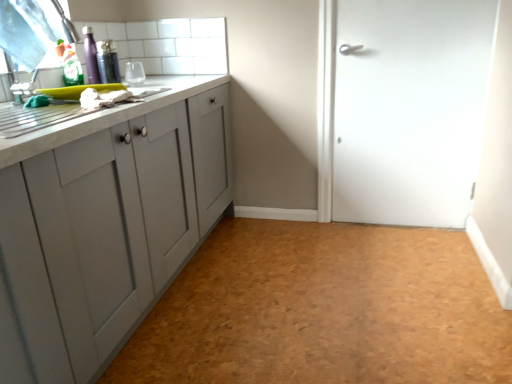
Question: From a real-world perspective, is white matte door at right physically above cork-textured floor at center?

Choices:
 (A) no
 (B) yes

Answer: (B)

Question: Is white matte door at right to the right of cork-textured floor at center from the viewer's perspective?

Choices:
 (A) no
 (B) yes

Answer: (B)

Question: Is white matte door at right smaller than cork-textured floor at center?

Choices:
 (A) yes
 (B) no

Answer: (A)

Question: Can you confirm if white matte door at right is bigger than cork-textured floor at center?

Choices:
 (A) no
 (B) yes

Answer: (A)

Question: Is white matte door at right outside of cork-textured floor at center?

Choices:
 (A) yes
 (B) no

Answer: (A)

Question: In the image, is transparent plastic window screen at upper left positioned in front of or behind white matte door at right?

Choices:
 (A) front
 (B) behind

Answer: (A)

Question: From a real-world perspective, relative to white matte door at right, is transparent plastic window screen at upper left vertically above or below?

Choices:
 (A) above
 (B) below

Answer: (A)

Question: Do you think transparent plastic window screen at upper left is within white matte door at right, or outside of it?

Choices:
 (A) outside
 (B) inside

Answer: (A)

Question: Based on their sizes in the image, would you say transparent plastic window screen at upper left is bigger or smaller than white matte door at right?

Choices:
 (A) big
 (B) small

Answer: (B)

Question: From a real-world perspective, relative to transparent plastic window screen at upper left, is cork-textured floor at center vertically above or below?

Choices:
 (A) below
 (B) above

Answer: (A)

Question: Choose the correct answer: Is cork-textured floor at center inside transparent plastic window screen at upper left or outside it?

Choices:
 (A) outside
 (B) inside

Answer: (A)

Question: Looking at their shapes, would you say cork-textured floor at center is wider or thinner than transparent plastic window screen at upper left?

Choices:
 (A) thin
 (B) wide

Answer: (B)

Question: From the image's perspective, is cork-textured floor at center located above or below transparent plastic window screen at upper left?

Choices:
 (A) below
 (B) above

Answer: (A)

Question: Is cork-textured floor at center bigger or smaller than white marble countertop at left?

Choices:
 (A) big
 (B) small

Answer: (A)

Question: From the image's perspective, is cork-textured floor at center located above or below white marble countertop at left?

Choices:
 (A) below
 (B) above

Answer: (A)